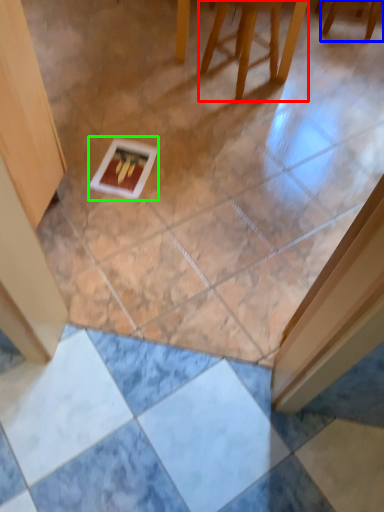
Question: Considering the real-world distances, which object is farthest from furniture (highlighted by a red box)? furniture (highlighted by a blue box) or postcard (highlighted by a green box)?

Choices:
 (A) furniture
 (B) postcard

Answer: (B)